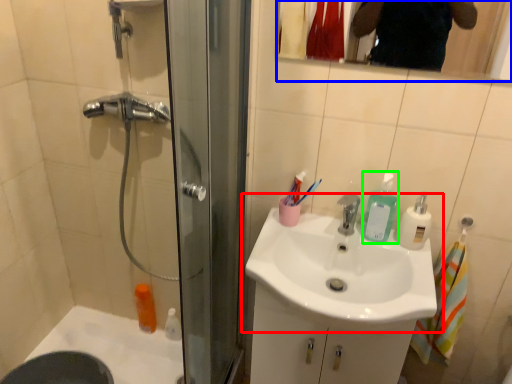
Question: Which object is positioned farthest from sink (highlighted by a red box)? Select from mirror (highlighted by a blue box) and soap dispenser (highlighted by a green box).

Choices:
 (A) mirror
 (B) soap dispenser

Answer: (A)